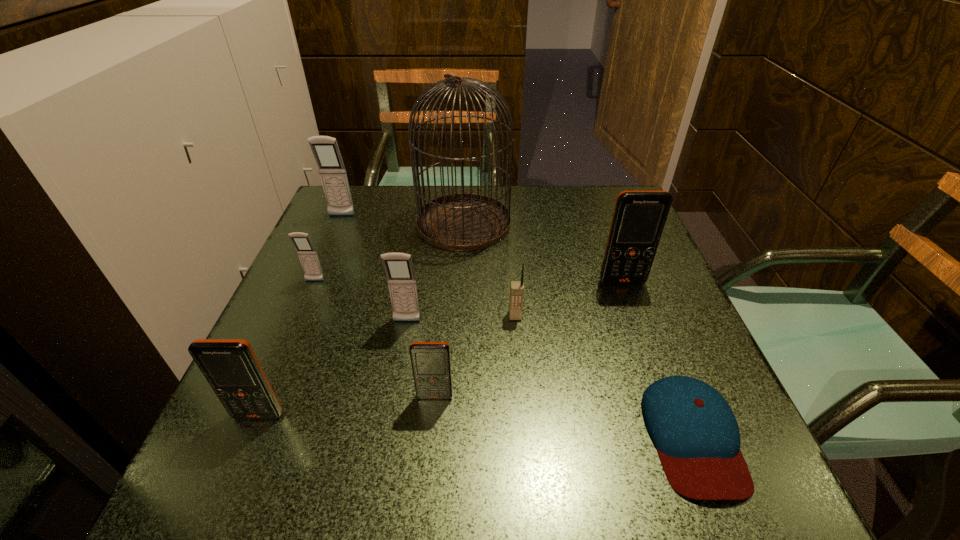
At what (x,y) coordinates should I click in order to perform the action: click on free space at the near edge of the desktop. Please return your answer as a coordinate pair (x, y). The width and height of the screenshot is (960, 540). Looking at the image, I should click on (471, 489).

In order to click on vacant space at the right edge of the desktop in this screenshot , I will do `click(595, 249)`.

The width and height of the screenshot is (960, 540). I want to click on vacant space at the far left corner, so click(370, 207).

This screenshot has height=540, width=960. I want to click on vacant space at the far right corner, so click(x=569, y=193).

This screenshot has height=540, width=960. In the image, there is a desktop. What are the coordinates of `vacant space at the near right corner` in the screenshot? It's located at (712, 509).

This screenshot has width=960, height=540. Identify the location of unoccupied area between the birdcage and the smallest gray cellular telephone. [389, 252].

You are a GUI agent. You are given a task and a screenshot of the screen. Output one action in this format:
    pyautogui.click(x=<x>, y=<y>)
    Task: Click on the vacant point located between the sixth cellular telephone from left to right and the biggest orange cellular telephone
    Image resolution: width=960 pixels, height=540 pixels.
    Given the screenshot: What is the action you would take?
    pyautogui.click(x=568, y=299)

You are a GUI agent. You are given a task and a screenshot of the screen. Output one action in this format:
    pyautogui.click(x=<x>, y=<y>)
    Task: Click on the vacant space in between the second orange cellular telephone from right to left and the smallest gray cellular telephone
    Image resolution: width=960 pixels, height=540 pixels.
    Given the screenshot: What is the action you would take?
    pyautogui.click(x=375, y=339)

This screenshot has height=540, width=960. What are the coordinates of `free area in between the biggest gray cellular telephone and the smallest orange cellular telephone` in the screenshot? It's located at (389, 306).

What are the coordinates of `vacant area between the tallest object and the smallest gray cellular telephone` in the screenshot? It's located at (389, 252).